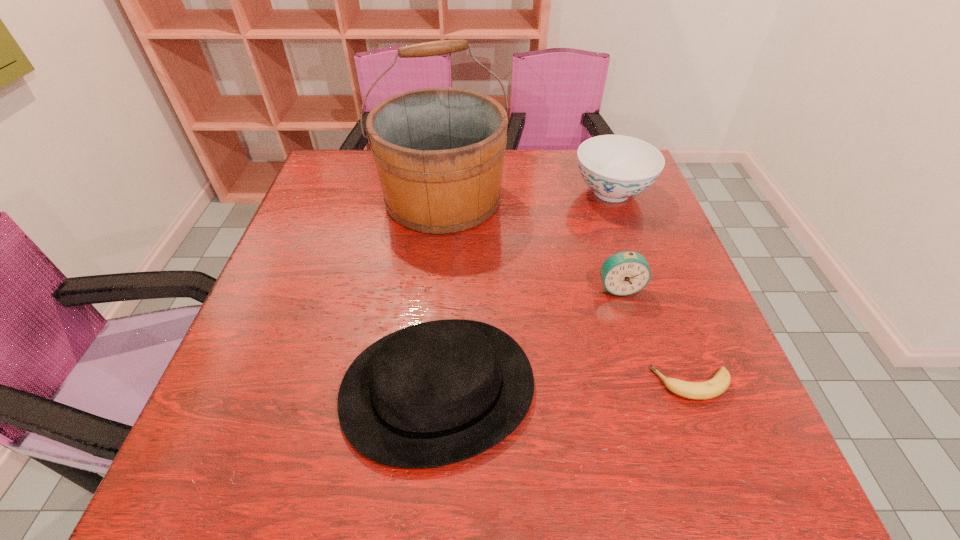
Identify the location of free point at the near edge. The width and height of the screenshot is (960, 540). (551, 443).

Image resolution: width=960 pixels, height=540 pixels. I want to click on vacant space at the left edge of the desktop, so click(303, 383).

At what (x,y) coordinates should I click in order to perform the action: click on vacant space at the right edge of the desktop. Please return your answer as a coordinate pair (x, y). Image resolution: width=960 pixels, height=540 pixels. Looking at the image, I should click on [x=712, y=440].

In the image, there is a desktop. At what (x,y) coordinates should I click in order to perform the action: click on vacant area at the far left corner. Please return your answer as a coordinate pair (x, y). This screenshot has height=540, width=960. Looking at the image, I should click on (354, 185).

In the image, there is a desktop. At what (x,y) coordinates should I click in order to perform the action: click on vacant space at the near left corner. Please return your answer as a coordinate pair (x, y). The width and height of the screenshot is (960, 540). Looking at the image, I should click on (289, 446).

Where is `vacant area between the alarm clock and the tallest object`? The height and width of the screenshot is (540, 960). vacant area between the alarm clock and the tallest object is located at coordinates (531, 243).

Identify the location of free space between the bucket and the chinaware. (527, 195).

Where is `vacant space that's between the alarm clock and the chinaware`? The image size is (960, 540). vacant space that's between the alarm clock and the chinaware is located at coordinates (615, 240).

This screenshot has height=540, width=960. I want to click on vacant point located between the chinaware and the third nearest object, so click(x=615, y=240).

I want to click on vacant space that's between the banana and the bucket, so click(x=567, y=291).